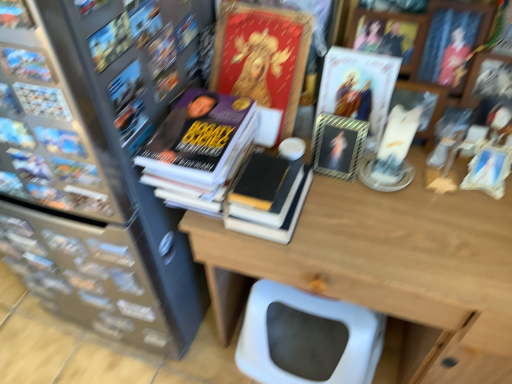
Question: Can you confirm if metallic gold frame at upper center, the 1th book cover when ordered from right to left, is smaller than matte black book at upper left, the first book positioned from the left?

Choices:
 (A) no
 (B) yes

Answer: (A)

Question: From the image's perspective, is metallic gold frame at upper center, which is the 3th book cover from left to right, located above matte black book at upper left, the first book positioned from the left?

Choices:
 (A) no
 (B) yes

Answer: (B)

Question: Does metallic gold frame at upper center, which is the 3th book cover from left to right, have a lesser width compared to matte black book at upper left, positioned as the 1th book in front-to-back order?

Choices:
 (A) yes
 (B) no

Answer: (B)

Question: From a real-world perspective, is metallic gold frame at upper center, the 1th book cover when ordered from right to left, located higher than matte black book at upper left, the third book viewed from the back?

Choices:
 (A) no
 (B) yes

Answer: (A)

Question: Considering the relative sizes of metallic gold frame at upper center, the 1th book cover when ordered from right to left, and matte black book at upper left, positioned as the 1th book in front-to-back order, in the image provided, is metallic gold frame at upper center, the 1th book cover when ordered from right to left, wider than matte black book at upper left, positioned as the 1th book in front-to-back order,?

Choices:
 (A) no
 (B) yes

Answer: (B)

Question: Considering the relative sizes of metallic gold frame at upper center, the 1th book cover when ordered from right to left, and matte black book at upper left, positioned as the 1th book in front-to-back order, in the image provided, is metallic gold frame at upper center, the 1th book cover when ordered from right to left, shorter than matte black book at upper left, positioned as the 1th book in front-to-back order,?

Choices:
 (A) yes
 (B) no

Answer: (B)

Question: Can we say metallic gold frame at upper center, which is the 3th book cover from left to right, lies outside metallic silver frame at upper center, the 2th book cover positioned from the right?

Choices:
 (A) no
 (B) yes

Answer: (B)

Question: Is metallic gold frame at upper center, the 1th book cover when ordered from right to left, wider than metallic silver frame at upper center, positioned as the 2th book cover in left-to-right order?

Choices:
 (A) yes
 (B) no

Answer: (A)

Question: Can you confirm if metallic gold frame at upper center, which is the 3th book cover from left to right, is positioned to the right of metallic silver frame at upper center, the 2th book cover positioned from the right?

Choices:
 (A) no
 (B) yes

Answer: (B)

Question: Is the surface of metallic gold frame at upper center, the 1th book cover when ordered from right to left, in direct contact with metallic silver frame at upper center, positioned as the 2th book cover in left-to-right order?

Choices:
 (A) yes
 (B) no

Answer: (A)

Question: Is metallic gold frame at upper center, the 1th book cover when ordered from right to left, not near metallic silver frame at upper center, the 2th book cover positioned from the right?

Choices:
 (A) no
 (B) yes

Answer: (A)

Question: From a real-world perspective, is metallic gold frame at upper center, the 1th book cover when ordered from right to left, positioned over metallic silver frame at upper center, positioned as the 2th book cover in left-to-right order, based on gravity?

Choices:
 (A) yes
 (B) no

Answer: (A)

Question: From a real-world perspective, is metallic silver frame at upper center, positioned as the 2th book cover in left-to-right order, over wooden table at center?

Choices:
 (A) yes
 (B) no

Answer: (A)